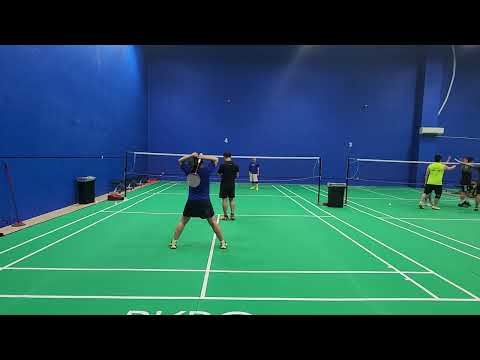
You are a GUI agent. You are given a task and a screenshot of the screen. Output one action in this format:
    pyautogui.click(x=<x>, y=<y>)
    Task: Click on the mop
    This screenshot has width=480, height=360.
    Given the screenshot: What is the action you would take?
    pyautogui.click(x=18, y=215)